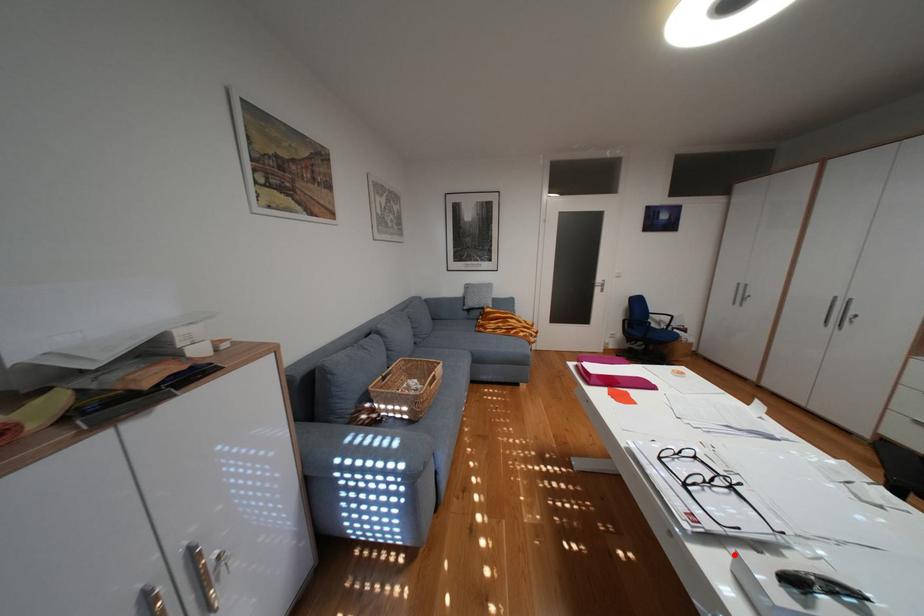
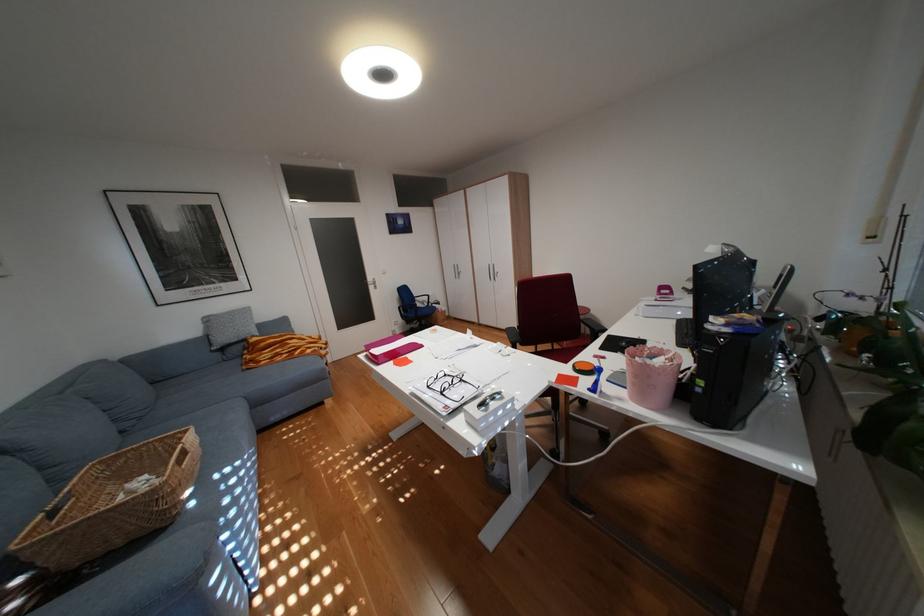
Where in the second image is the point corresponding to the highlighted location from the first image?

(473, 416)